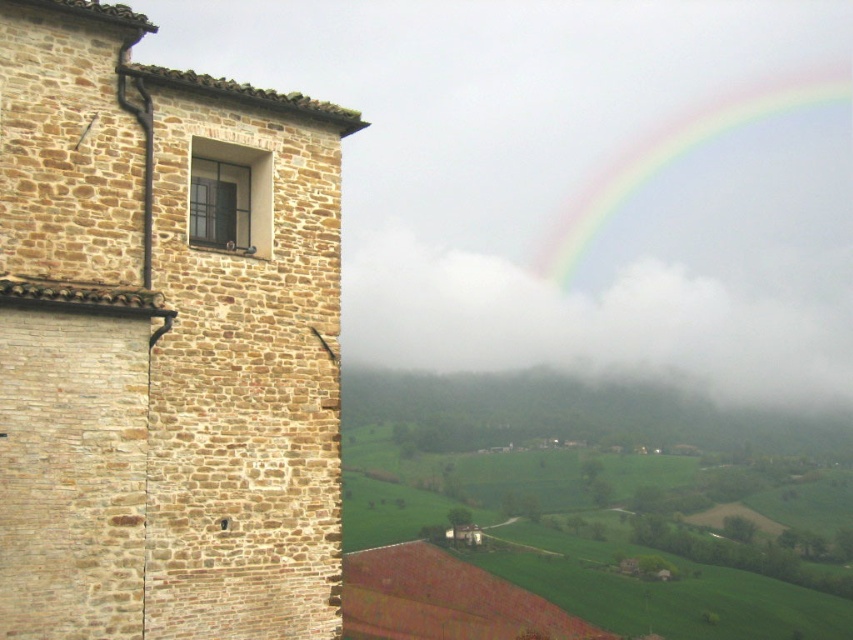
Between white fluffy cloud at upper center and rainbow at upper right, which one has more height?

rainbow at upper right is taller.

Between white fluffy cloud at upper center and rainbow at upper right, which one is positioned lower?

Positioned lower is white fluffy cloud at upper center.

Which is behind, point (425, 365) or point (735, 122)?

The point (735, 122) is behind.

Where is `white fluffy cloud at upper center`? This screenshot has width=853, height=640. white fluffy cloud at upper center is located at coordinates (592, 323).

This screenshot has height=640, width=853. What do you see at coordinates (677, 154) in the screenshot?
I see `rainbow at upper right` at bounding box center [677, 154].

Which of these two, rainbow at upper right or matte glass window at upper left, stands taller?

rainbow at upper right

Which is behind, point (686, 129) or point (238, 188)?

Positioned behind is point (686, 129).

The height and width of the screenshot is (640, 853). What are the coordinates of `rainbow at upper right` in the screenshot? It's located at (677, 154).

Can you confirm if brown stone tower at left is positioned below white fluffy cloud at upper center?

Indeed, brown stone tower at left is positioned under white fluffy cloud at upper center.

Describe the element at coordinates (160, 348) in the screenshot. I see `brown stone tower at left` at that location.

Where is `brown stone tower at left`? Image resolution: width=853 pixels, height=640 pixels. brown stone tower at left is located at coordinates (160, 348).